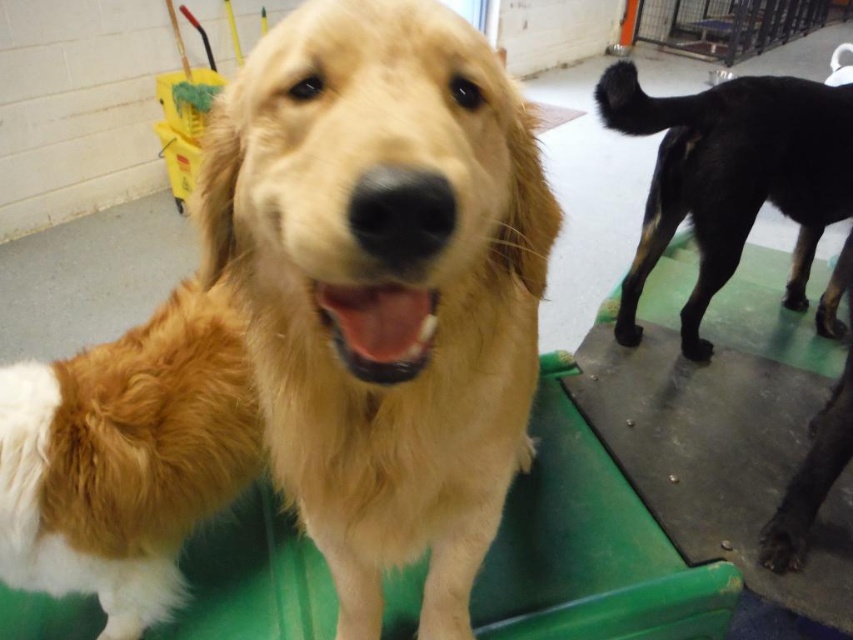
Question: Is golden fur dog at center further to the viewer compared to black glossy dog at right?

Choices:
 (A) yes
 (B) no

Answer: (B)

Question: Which object appears closest to the camera in this image?

Choices:
 (A) golden fur dog at center
 (B) black glossy dog at right

Answer: (A)

Question: Does golden fur dog at center appear on the right side of black glossy dog at right?

Choices:
 (A) yes
 (B) no

Answer: (B)

Question: Is golden fur dog at center bigger than black glossy dog at right?

Choices:
 (A) yes
 (B) no

Answer: (B)

Question: Which point appears farthest from the camera in this image?

Choices:
 (A) (502, 268)
 (B) (741, 189)

Answer: (B)